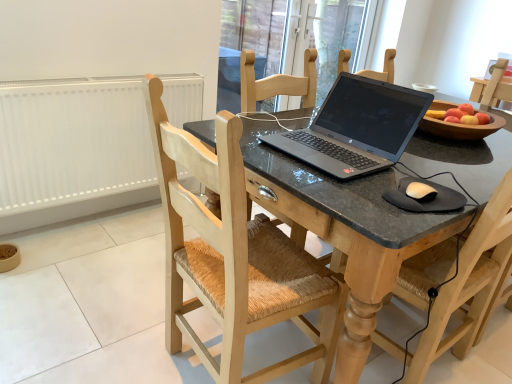
Find the location of `vacant space that's between slate gray laptop at center and black rubber mousepad at lower right`. vacant space that's between slate gray laptop at center and black rubber mousepad at lower right is located at coordinates (406, 177).